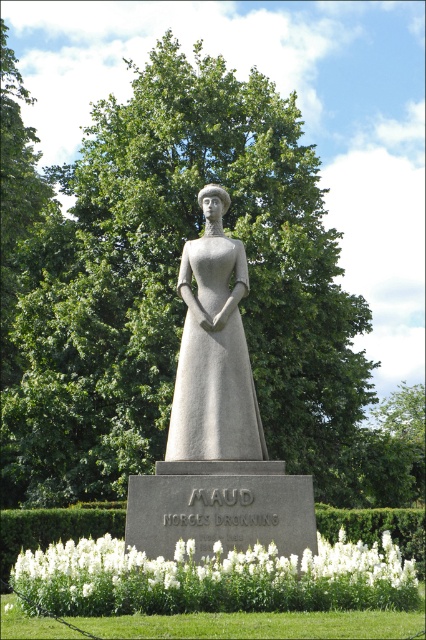
Question: Where is gray stone statue at center located in relation to gray stone dress at center in the image?

Choices:
 (A) above
 (B) below

Answer: (B)

Question: Is gray stone statue at center smaller than gray stone dress at center?

Choices:
 (A) yes
 (B) no

Answer: (B)

Question: Can you confirm if gray stone statue at center is positioned below gray stone dress at center?

Choices:
 (A) no
 (B) yes

Answer: (B)

Question: Among these objects, which one is nearest to the camera?

Choices:
 (A) gray stone statue at center
 (B) gray stone dress at center

Answer: (A)